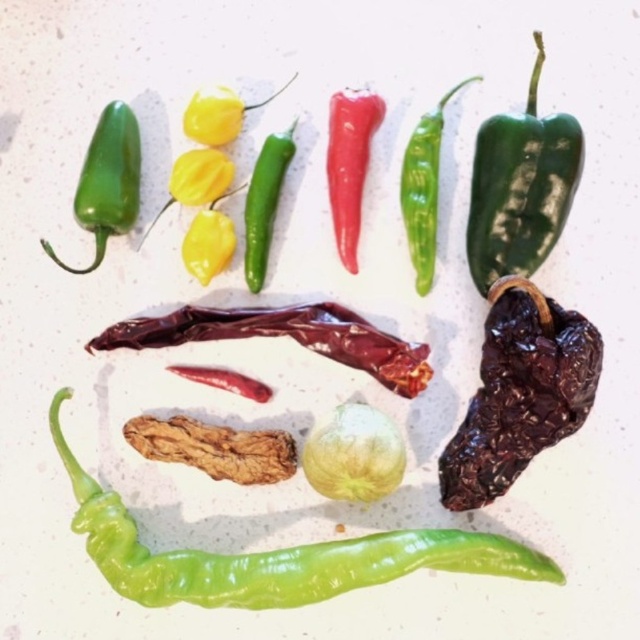
Question: Can you confirm if brown wrinkled pepper at center is bigger than green glossy chili pepper at left?

Choices:
 (A) yes
 (B) no

Answer: (B)

Question: Which object appears farthest from the camera in this image?

Choices:
 (A) shiny red pepper at center
 (B) green glossy pepper at lower center
 (C) dry wrinkled chili pepper at center

Answer: (A)

Question: Which of the following is the farthest from the observer?

Choices:
 (A) (83, 531)
 (B) (465, 499)
 (C) (420, 381)
 (D) (484, 230)

Answer: (C)

Question: Where is dry wrinkled chili pepper at center-right located in relation to green glossy pepper at upper center in the image?

Choices:
 (A) below
 (B) above

Answer: (A)

Question: Which point is farther to the camera?

Choices:
 (A) dry wrinkled chili pepper at center
 (B) pale yellow/green translucent garlic at center
 (C) green glossy bell pepper at upper right

Answer: (A)

Question: Is the position of green glossy bell pepper at upper right less distant than that of dry wrinkled chili pepper at center?

Choices:
 (A) no
 (B) yes

Answer: (B)